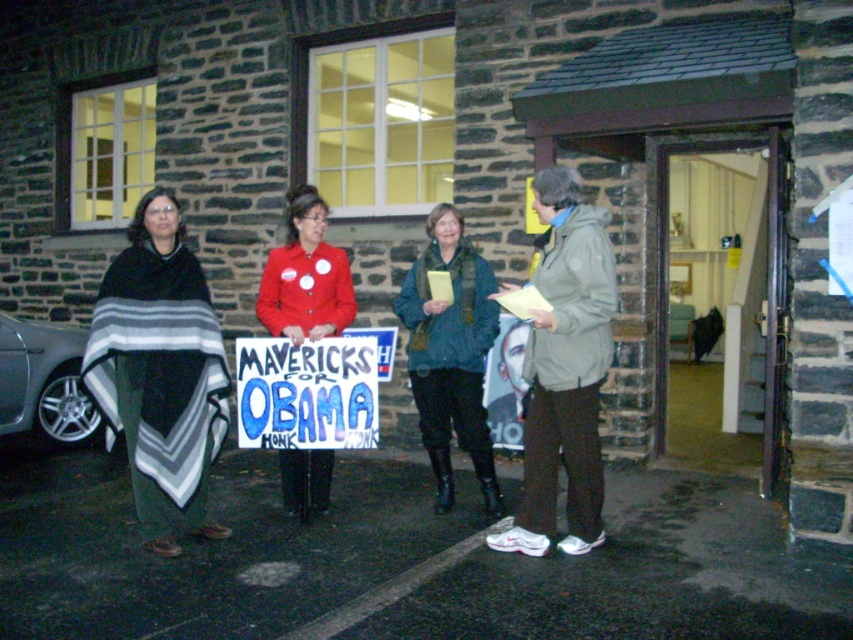
Who is higher up, striped wool poncho at left or red matte jacket at center?

Positioned higher is red matte jacket at center.

Does point (166, 406) come closer to viewer compared to point (276, 310)?

Yes, point (166, 406) is closer to viewer.

The width and height of the screenshot is (853, 640). What are the coordinates of `striped wool poncho at left` in the screenshot? It's located at (160, 371).

Is point (105, 285) closer to camera compared to point (292, 390)?

Yes, point (105, 285) is closer to viewer.

You are a GUI agent. You are given a task and a screenshot of the screen. Output one action in this format:
    pyautogui.click(x=<x>, y=<y>)
    Task: Click on the striped wool poncho at left
    
    Given the screenshot: What is the action you would take?
    pyautogui.click(x=160, y=371)

Measure the distance between blue-green textured scarf at center and blue painted cardboard sign at center.

A distance of 25.28 inches exists between blue-green textured scarf at center and blue painted cardboard sign at center.

Which of these two, blue-green textured scarf at center or blue painted cardboard sign at center, stands taller?

blue-green textured scarf at center is taller.

This screenshot has height=640, width=853. Describe the element at coordinates (451, 353) in the screenshot. I see `blue-green textured scarf at center` at that location.

The height and width of the screenshot is (640, 853). What are the coordinates of `blue-green textured scarf at center` in the screenshot? It's located at (451, 353).